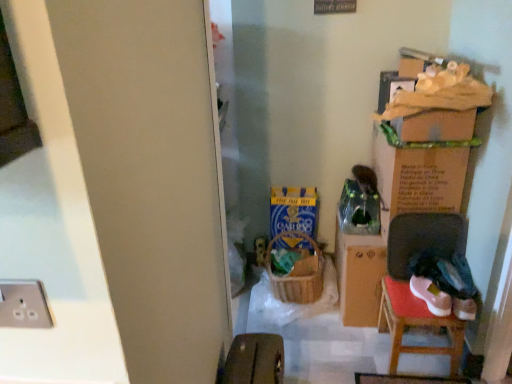
In order to face cardboard box at upper right, which is the second cardboard box in left-to-right order, should I rotate leftwards or rightwards?

You should look right and rotate roughly 20.082 degrees.

I want to click on blue cardboard box at center, the first cardboard box in the left-to-right sequence, so click(x=294, y=210).

The width and height of the screenshot is (512, 384). What do you see at coordinates (408, 283) in the screenshot? I see `wooden chair at lower right` at bounding box center [408, 283].

What is the approximate width of silver metallic socket at lower left?

The width of silver metallic socket at lower left is 1.72 centimeters.

The width and height of the screenshot is (512, 384). What are the coordinates of `pink suede shoes at lower right` in the screenshot? It's located at (431, 296).

Where is `cardboard box at upper right, the first cardboard box viewed from the right`? cardboard box at upper right, the first cardboard box viewed from the right is located at coordinates (418, 174).

What's the angular difference between woven brown laundry basket at center and cardboard box at upper right, which is the second cardboard box in left-to-right order,'s facing directions?

woven brown laundry basket at center and cardboard box at upper right, which is the second cardboard box in left-to-right order, are facing 0.000397 degrees away from each other.

From their relative heights in the image, would you say woven brown laundry basket at center is taller or shorter than cardboard box at upper right, the first cardboard box viewed from the right?

Clearly, woven brown laundry basket at center is shorter compared to cardboard box at upper right, the first cardboard box viewed from the right.

From the image's perspective, between woven brown laundry basket at center and cardboard box at upper right, the first cardboard box viewed from the right, which one is located above?

cardboard box at upper right, the first cardboard box viewed from the right, from the image's perspective.

Would you say woven brown laundry basket at center is a long distance from wooden chair at lower right?

Actually, woven brown laundry basket at center and wooden chair at lower right are a little close together.

What's the angular difference between woven brown laundry basket at center and wooden chair at lower right's facing directions?

The facing directions of woven brown laundry basket at center and wooden chair at lower right are 2.92 degrees apart.

From the image's perspective, relative to wooden chair at lower right, is woven brown laundry basket at center above or below?

Based on their image positions, woven brown laundry basket at center is located above wooden chair at lower right.

Is point (317, 286) behind point (442, 317)?

Yes, point (317, 286) is behind point (442, 317).

From a real-world perspective, does wooden chair at lower right sit lower than woven brown laundry basket at center?

Yes, from a real-world perspective, wooden chair at lower right is beneath woven brown laundry basket at center.

Can we say wooden chair at lower right lies outside woven brown laundry basket at center?

Yes, wooden chair at lower right is not within woven brown laundry basket at center.

Consider the image. Can you confirm if wooden chair at lower right is positioned to the left of woven brown laundry basket at center?

No, wooden chair at lower right is not to the left of woven brown laundry basket at center.

Considering the positions of point (459, 248) and point (319, 281), is point (459, 248) closer or farther from the camera than point (319, 281)?

Point (459, 248).

Which of these two, pink suede shoes at lower right or silver metallic socket at lower left, is bigger?

Bigger between the two is pink suede shoes at lower right.

Looking at this image, how many degrees apart are the facing directions of pink suede shoes at lower right and silver metallic socket at lower left?

There is a 3.57-degree angle between the facing directions of pink suede shoes at lower right and silver metallic socket at lower left.

Are pink suede shoes at lower right and silver metallic socket at lower left beside each other?

No, pink suede shoes at lower right is not touching silver metallic socket at lower left.

Which object is positioned more to the left, pink suede shoes at lower right or silver metallic socket at lower left?

Positioned to the left is silver metallic socket at lower left.

Is cardboard box at upper right, the first cardboard box viewed from the right, behind matte brown suitcase at lower center?

Yes, cardboard box at upper right, the first cardboard box viewed from the right, is behind matte brown suitcase at lower center.

From the image's perspective, between cardboard box at upper right, the first cardboard box viewed from the right, and matte brown suitcase at lower center, which one is located above?

cardboard box at upper right, the first cardboard box viewed from the right, from the image's perspective.

Considering the positions of points (380, 158) and (238, 376), is point (380, 158) closer to camera compared to point (238, 376)?

That is False.

Considering the sizes of pink suede shoes at lower right and blue cardboard box at center, the first cardboard box in the left-to-right sequence, in the image, is pink suede shoes at lower right wider or thinner than blue cardboard box at center, the first cardboard box in the left-to-right sequence,?

Considering their sizes, pink suede shoes at lower right looks broader than blue cardboard box at center, the first cardboard box in the left-to-right sequence.

From the image's perspective, between pink suede shoes at lower right and blue cardboard box at center, marked as the 2th cardboard box in a right-to-left arrangement, which one is located above?

blue cardboard box at center, marked as the 2th cardboard box in a right-to-left arrangement, appears higher in the image.

Based on their sizes in the image, would you say pink suede shoes at lower right is bigger or smaller than blue cardboard box at center, marked as the 2th cardboard box in a right-to-left arrangement?

Considering their sizes, pink suede shoes at lower right takes up less space than blue cardboard box at center, marked as the 2th cardboard box in a right-to-left arrangement.

Is pink suede shoes at lower right in front of blue cardboard box at center, the first cardboard box in the left-to-right sequence?

Yes, it is in front of blue cardboard box at center, the first cardboard box in the left-to-right sequence.

Between wooden chair at lower right and pink suede shoes at lower right, which one has less height?

Standing shorter between the two is pink suede shoes at lower right.

Considering the points (395, 335) and (443, 309), which point is behind, point (395, 335) or point (443, 309)?

The point (395, 335) is farther.

Is wooden chair at lower right beside pink suede shoes at lower right?

No.

The image size is (512, 384). In the image, there is a cardboard box at upper right, which is the second cardboard box in left-to-right order. What are the coordinates of `laundry basket below it (from the image's perspective)` in the screenshot? It's located at (296, 277).

Where is `laundry basket that appears behind the wooden chair at lower right`? This screenshot has height=384, width=512. laundry basket that appears behind the wooden chair at lower right is located at coordinates (296, 277).

Which object lies nearer to the anchor point cardboard box at upper right, which is the second cardboard box in left-to-right order, woven brown laundry basket at center or blue cardboard box at center, the first cardboard box in the left-to-right sequence?

blue cardboard box at center, the first cardboard box in the left-to-right sequence, lies closer to cardboard box at upper right, which is the second cardboard box in left-to-right order, than the other object.

Estimate the real-world distances between objects in this image. Which object is closer to wooden chair at lower right, pink suede shoes at lower right or woven brown laundry basket at center?

pink suede shoes at lower right is closer to wooden chair at lower right.

Considering their positions, is cardboard box at upper right, the first cardboard box viewed from the right, positioned further to pink suede shoes at lower right than blue cardboard box at center, the first cardboard box in the left-to-right sequence?

The object further to pink suede shoes at lower right is blue cardboard box at center, the first cardboard box in the left-to-right sequence.

From the image, which object appears to be nearer to blue cardboard box at center, marked as the 2th cardboard box in a right-to-left arrangement, wooden chair at lower right or woven brown laundry basket at center?

woven brown laundry basket at center is closer to blue cardboard box at center, marked as the 2th cardboard box in a right-to-left arrangement.

From the image, which object appears to be nearer to silver metallic socket at lower left, matte brown suitcase at lower center or blue cardboard box at center, marked as the 2th cardboard box in a right-to-left arrangement?

matte brown suitcase at lower center.

Which object lies further to the anchor point cardboard box at upper right, the first cardboard box viewed from the right, wooden chair at lower right or woven brown laundry basket at center?

woven brown laundry basket at center is positioned further to the anchor cardboard box at upper right, the first cardboard box viewed from the right.

Considering their positions, is woven brown laundry basket at center positioned further to silver metallic socket at lower left than blue cardboard box at center, the first cardboard box in the left-to-right sequence?

blue cardboard box at center, the first cardboard box in the left-to-right sequence.

From the image, which object appears to be nearer to cardboard box at upper right, the first cardboard box viewed from the right, blue cardboard box at center, marked as the 2th cardboard box in a right-to-left arrangement, or woven brown laundry basket at center?

The object closer to cardboard box at upper right, the first cardboard box viewed from the right, is blue cardboard box at center, marked as the 2th cardboard box in a right-to-left arrangement.

You are a GUI agent. You are given a task and a screenshot of the screen. Output one action in this format:
    pyautogui.click(x=<x>, y=<y>)
    Task: Click on the cardboard box between matte brown suitcase at lower center and blue cardboard box at center, the first cardboard box in the left-to-right sequence, in the front-back direction
    
    Given the screenshot: What is the action you would take?
    pyautogui.click(x=418, y=174)

What are the coordinates of `chair located between silver metallic socket at lower left and cardboard box at upper right, the first cardboard box viewed from the right, in the depth direction` in the screenshot? It's located at (408, 283).

You are a GUI agent. You are given a task and a screenshot of the screen. Output one action in this format:
    pyautogui.click(x=<x>, y=<y>)
    Task: Click on the footwear between cardboard box at upper right, the first cardboard box viewed from the right, and wooden chair at lower right from top to bottom
    
    Given the screenshot: What is the action you would take?
    pyautogui.click(x=431, y=296)

Identify the location of chair between blue cardboard box at center, the first cardboard box in the left-to-right sequence, and pink suede shoes at lower right. (408, 283).